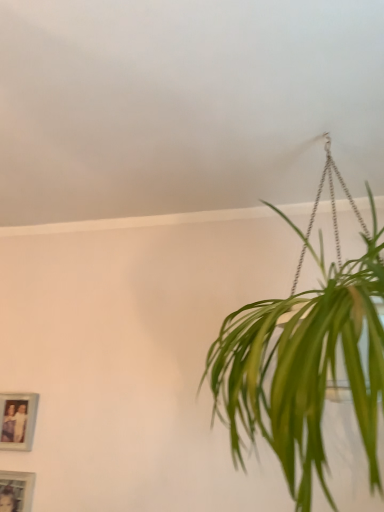
How much space does matte blue picture frame at lower left, which ranks as the 1th picture frame in top-to-bottom order, occupy vertically?

6.89 inches.

Describe the element at coordinates (17, 420) in the screenshot. The height and width of the screenshot is (512, 384). I see `matte blue picture frame at lower left, which ranks as the 1th picture frame in top-to-bottom order` at that location.

Where is `matte blue picture frame at lower left, which ranks as the 1th picture frame in top-to-bottom order`? The image size is (384, 512). matte blue picture frame at lower left, which ranks as the 1th picture frame in top-to-bottom order is located at coordinates (17, 420).

How much space does wooden photo frame at lower left, the 1th picture frame ordered from the bottom, occupy vertically?

The height of wooden photo frame at lower left, the 1th picture frame ordered from the bottom, is 9.29 inches.

What is the approximate width of wooden photo frame at lower left, which is the second picture frame in top-to-bottom order?

wooden photo frame at lower left, which is the second picture frame in top-to-bottom order, is 1.94 centimeters in width.

What do you see at coordinates (16, 490) in the screenshot? This screenshot has width=384, height=512. I see `wooden photo frame at lower left, the 1th picture frame ordered from the bottom` at bounding box center [16, 490].

You are a GUI agent. You are given a task and a screenshot of the screen. Output one action in this format:
    pyautogui.click(x=<x>, y=<y>)
    Task: Click on the wooden photo frame at lower left, the 1th picture frame ordered from the bottom
    
    Given the screenshot: What is the action you would take?
    pyautogui.click(x=16, y=490)

You are a GUI agent. You are given a task and a screenshot of the screen. Output one action in this format:
    pyautogui.click(x=<x>, y=<y>)
    Task: Click on the matte blue picture frame at lower left, which is the 2th picture frame from bottom to top
    Image resolution: width=384 pixels, height=512 pixels.
    Given the screenshot: What is the action you would take?
    pyautogui.click(x=17, y=420)

Considering the positions of objects wooden photo frame at lower left, the 1th picture frame ordered from the bottom, and matte blue picture frame at lower left, which ranks as the 1th picture frame in top-to-bottom order, in the image provided, who is more to the left, wooden photo frame at lower left, the 1th picture frame ordered from the bottom, or matte blue picture frame at lower left, which ranks as the 1th picture frame in top-to-bottom order,?

matte blue picture frame at lower left, which ranks as the 1th picture frame in top-to-bottom order.

Considering the relative positions of wooden photo frame at lower left, which is the second picture frame in top-to-bottom order, and matte blue picture frame at lower left, which is the 2th picture frame from bottom to top, in the image provided, is wooden photo frame at lower left, which is the second picture frame in top-to-bottom order, behind matte blue picture frame at lower left, which is the 2th picture frame from bottom to top,?

No.

Is point (16, 478) behind point (28, 405)?

That is False.

From the image's perspective, which is above, wooden photo frame at lower left, which is the second picture frame in top-to-bottom order, or matte blue picture frame at lower left, which ranks as the 1th picture frame in top-to-bottom order?

From the image's view, matte blue picture frame at lower left, which ranks as the 1th picture frame in top-to-bottom order, is above.

From a real-world perspective, who is located higher, wooden photo frame at lower left, the 1th picture frame ordered from the bottom, or matte blue picture frame at lower left, which ranks as the 1th picture frame in top-to-bottom order?

matte blue picture frame at lower left, which ranks as the 1th picture frame in top-to-bottom order, from a real-world perspective.

Considering the relative sizes of wooden photo frame at lower left, which is the second picture frame in top-to-bottom order, and matte blue picture frame at lower left, which ranks as the 1th picture frame in top-to-bottom order, in the image provided, is wooden photo frame at lower left, which is the second picture frame in top-to-bottom order, wider than matte blue picture frame at lower left, which ranks as the 1th picture frame in top-to-bottom order,?

No, wooden photo frame at lower left, which is the second picture frame in top-to-bottom order, is not wider than matte blue picture frame at lower left, which ranks as the 1th picture frame in top-to-bottom order.

Does wooden photo frame at lower left, which is the second picture frame in top-to-bottom order, have a greater height compared to matte blue picture frame at lower left, which ranks as the 1th picture frame in top-to-bottom order?

Yes, wooden photo frame at lower left, which is the second picture frame in top-to-bottom order, is taller than matte blue picture frame at lower left, which ranks as the 1th picture frame in top-to-bottom order.

Who is bigger, wooden photo frame at lower left, which is the second picture frame in top-to-bottom order, or matte blue picture frame at lower left, which ranks as the 1th picture frame in top-to-bottom order?

wooden photo frame at lower left, which is the second picture frame in top-to-bottom order, is bigger.

Is wooden photo frame at lower left, which is the second picture frame in top-to-bottom order, inside the boundaries of matte blue picture frame at lower left, which ranks as the 1th picture frame in top-to-bottom order, or outside?

wooden photo frame at lower left, which is the second picture frame in top-to-bottom order, is not inside matte blue picture frame at lower left, which ranks as the 1th picture frame in top-to-bottom order, it's outside.

Is wooden photo frame at lower left, which is the second picture frame in top-to-bottom order, far from matte blue picture frame at lower left, which is the 2th picture frame from bottom to top?

wooden photo frame at lower left, which is the second picture frame in top-to-bottom order, is actually quite close to matte blue picture frame at lower left, which is the 2th picture frame from bottom to top.

Is wooden photo frame at lower left, which is the second picture frame in top-to-bottom order, facing towards matte blue picture frame at lower left, which is the 2th picture frame from bottom to top?

No, wooden photo frame at lower left, which is the second picture frame in top-to-bottom order, is not oriented towards matte blue picture frame at lower left, which is the 2th picture frame from bottom to top.

How many degrees apart are the facing directions of wooden photo frame at lower left, the 1th picture frame ordered from the bottom, and matte blue picture frame at lower left, which ranks as the 1th picture frame in top-to-bottom order?

The facing directions of wooden photo frame at lower left, the 1th picture frame ordered from the bottom, and matte blue picture frame at lower left, which ranks as the 1th picture frame in top-to-bottom order, are 1.96 degrees apart.

The image size is (384, 512). Identify the location of picture frame on the left of wooden photo frame at lower left, the 1th picture frame ordered from the bottom. (17, 420).

Based on their positions, is matte blue picture frame at lower left, which is the 2th picture frame from bottom to top, located to the left or right of wooden photo frame at lower left, which is the second picture frame in top-to-bottom order?

From the image, it's evident that matte blue picture frame at lower left, which is the 2th picture frame from bottom to top, is to the left of wooden photo frame at lower left, which is the second picture frame in top-to-bottom order.

Is matte blue picture frame at lower left, which is the 2th picture frame from bottom to top, in front of wooden photo frame at lower left, which is the second picture frame in top-to-bottom order?

No, it is not.

Does point (25, 421) lie in front of point (10, 475)?

No, it is not.

From the image's perspective, between matte blue picture frame at lower left, which is the 2th picture frame from bottom to top, and wooden photo frame at lower left, which is the second picture frame in top-to-bottom order, which one is located above?

From the image's view, matte blue picture frame at lower left, which is the 2th picture frame from bottom to top, is above.

From a real-world perspective, is matte blue picture frame at lower left, which ranks as the 1th picture frame in top-to-bottom order, above or below wooden photo frame at lower left, which is the second picture frame in top-to-bottom order?

matte blue picture frame at lower left, which ranks as the 1th picture frame in top-to-bottom order, is situated higher than wooden photo frame at lower left, which is the second picture frame in top-to-bottom order, in the real world.

Considering the sizes of objects matte blue picture frame at lower left, which ranks as the 1th picture frame in top-to-bottom order, and wooden photo frame at lower left, which is the second picture frame in top-to-bottom order, in the image provided, who is thinner, matte blue picture frame at lower left, which ranks as the 1th picture frame in top-to-bottom order, or wooden photo frame at lower left, which is the second picture frame in top-to-bottom order,?

wooden photo frame at lower left, which is the second picture frame in top-to-bottom order, is thinner.

Considering the relative sizes of matte blue picture frame at lower left, which ranks as the 1th picture frame in top-to-bottom order, and wooden photo frame at lower left, which is the second picture frame in top-to-bottom order, in the image provided, is matte blue picture frame at lower left, which ranks as the 1th picture frame in top-to-bottom order, taller than wooden photo frame at lower left, which is the second picture frame in top-to-bottom order,?

No, matte blue picture frame at lower left, which ranks as the 1th picture frame in top-to-bottom order, is not taller than wooden photo frame at lower left, which is the second picture frame in top-to-bottom order.

Which of these two, matte blue picture frame at lower left, which is the 2th picture frame from bottom to top, or wooden photo frame at lower left, the 1th picture frame ordered from the bottom, is smaller?

Smaller between the two is matte blue picture frame at lower left, which is the 2th picture frame from bottom to top.

Is matte blue picture frame at lower left, which is the 2th picture frame from bottom to top, spatially inside wooden photo frame at lower left, the 1th picture frame ordered from the bottom, or outside of it?

matte blue picture frame at lower left, which is the 2th picture frame from bottom to top, cannot be found inside wooden photo frame at lower left, the 1th picture frame ordered from the bottom.

Is matte blue picture frame at lower left, which ranks as the 1th picture frame in top-to-bottom order, not close to wooden photo frame at lower left, the 1th picture frame ordered from the bottom?

They are positioned close to each other.

Is matte blue picture frame at lower left, which ranks as the 1th picture frame in top-to-bottom order, facing away from wooden photo frame at lower left, the 1th picture frame ordered from the bottom?

No, wooden photo frame at lower left, the 1th picture frame ordered from the bottom, is not at the back of matte blue picture frame at lower left, which ranks as the 1th picture frame in top-to-bottom order.

How far apart are matte blue picture frame at lower left, which is the 2th picture frame from bottom to top, and wooden photo frame at lower left, which is the second picture frame in top-to-bottom order?

13.44 centimeters.

Where is `picture frame on the right of matte blue picture frame at lower left, which is the 2th picture frame from bottom to top`? This screenshot has height=512, width=384. picture frame on the right of matte blue picture frame at lower left, which is the 2th picture frame from bottom to top is located at coordinates (16, 490).

Locate an element on the screen. This screenshot has height=512, width=384. picture frame that appears behind the wooden photo frame at lower left, which is the second picture frame in top-to-bottom order is located at coordinates click(x=17, y=420).

Image resolution: width=384 pixels, height=512 pixels. Identify the location of picture frame below the matte blue picture frame at lower left, which ranks as the 1th picture frame in top-to-bottom order (from the image's perspective). (16, 490).